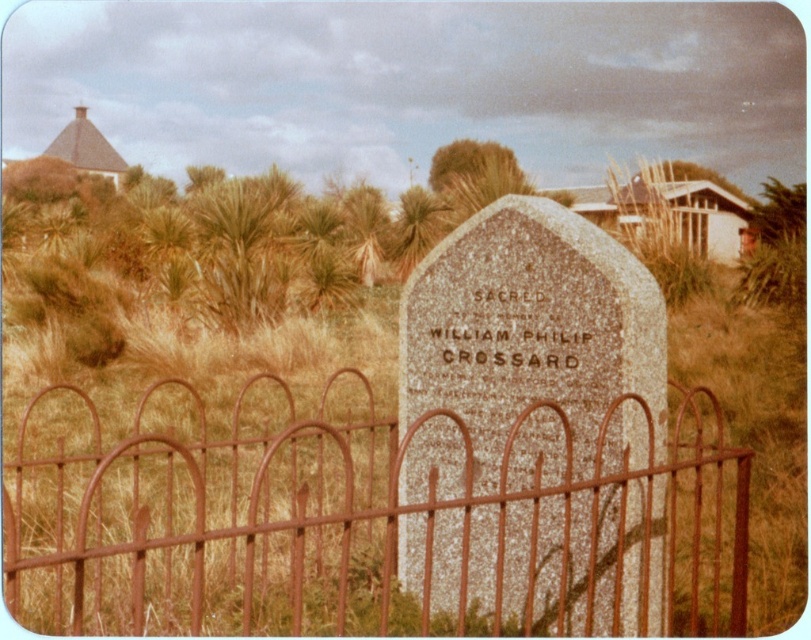
Does rusty metal fence at center have a lesser height compared to granite gravestone at center?

Yes, rusty metal fence at center is shorter than granite gravestone at center.

Is point (410, 612) positioned behind point (646, 364)?

Yes, point (410, 612) is farther from viewer.

What are the coordinates of `rusty metal fence at center` in the screenshot? It's located at (382, 518).